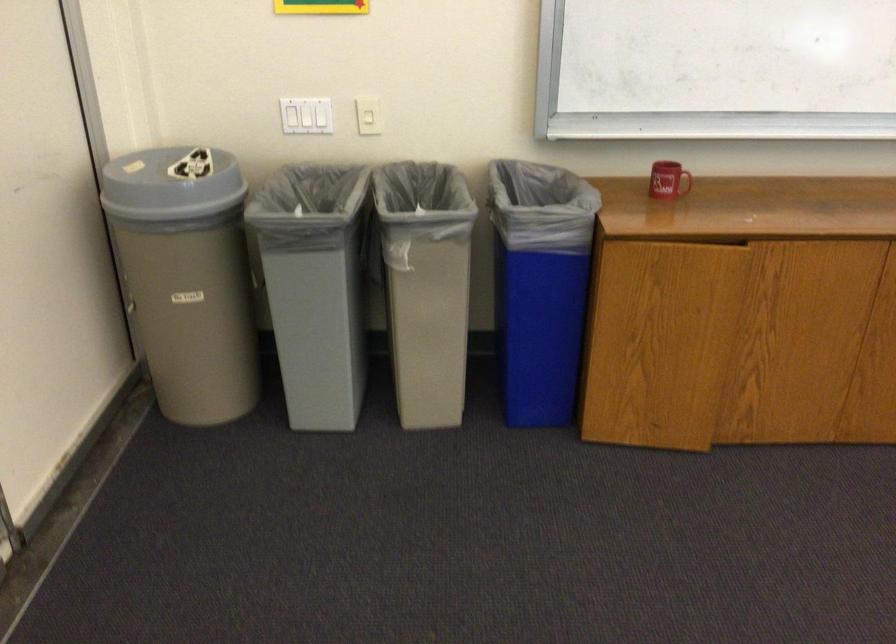
Find where to pull the cabinet door pull. Please return your answer as a coordinate pair (x, y).

(736, 242)